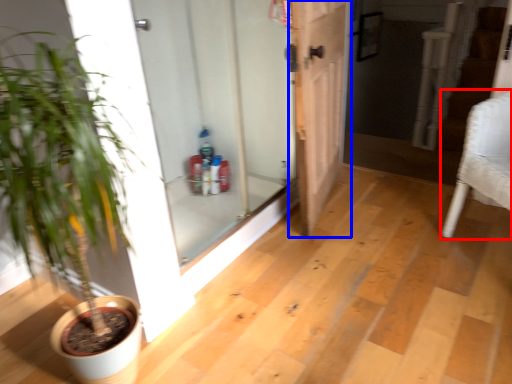
Question: Which object is further to the camera taking this photo, armchair (highlighted by a red box) or door (highlighted by a blue box)?

Choices:
 (A) armchair
 (B) door

Answer: (B)